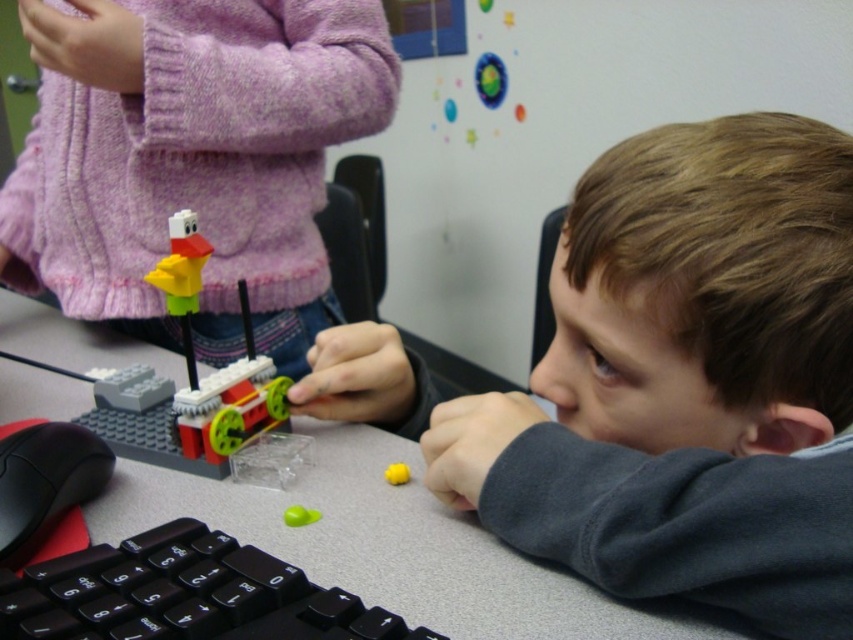
Based on the photo, you are a photographer trying to capture a closeup of the gray matte table at center and the green matte ball at center. Since you can only focus on one object at a time, which object should you choose to ensure the other remains in the background?

You should focus on the gray matte table at center because it is closer to the viewer, allowing the green matte ball at center to naturally appear in the background.

What are the coordinates of the matte plastic toy at center in the image?

The coordinates of the matte plastic toy at center are at point (201, 168).